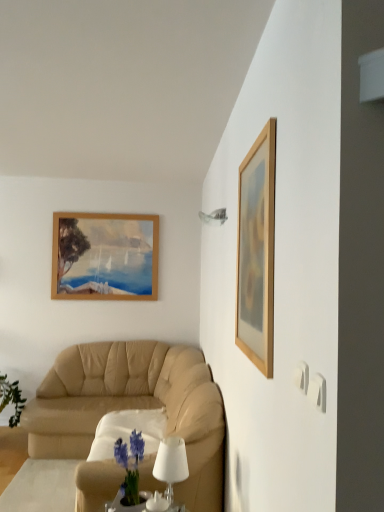
Question: Could you tell me if white matte table lamp at lower center is facing wooden picture frame at upper right?

Choices:
 (A) yes
 (B) no

Answer: (B)

Question: Is white matte table lamp at lower center to the left of wooden picture frame at upper right from the viewer's perspective?

Choices:
 (A) yes
 (B) no

Answer: (A)

Question: Is white matte table lamp at lower center taller than wooden picture frame at upper right?

Choices:
 (A) no
 (B) yes

Answer: (A)

Question: Is white matte table lamp at lower center behind wooden picture frame at upper right?

Choices:
 (A) no
 (B) yes

Answer: (B)

Question: Can you confirm if white matte table lamp at lower center is positioned to the right of wooden picture frame at upper right?

Choices:
 (A) no
 (B) yes

Answer: (A)

Question: From the image's perspective, is beige leather couch at lower left above or below wooden picture frame at upper right?

Choices:
 (A) below
 (B) above

Answer: (A)

Question: Is beige leather couch at lower left inside the boundaries of wooden picture frame at upper right, or outside?

Choices:
 (A) outside
 (B) inside

Answer: (A)

Question: Considering the positions of beige leather couch at lower left and wooden picture frame at upper right in the image, is beige leather couch at lower left wider or thinner than wooden picture frame at upper right?

Choices:
 (A) thin
 (B) wide

Answer: (B)

Question: Is beige leather couch at lower left in front of or behind wooden picture frame at upper right in the image?

Choices:
 (A) front
 (B) behind

Answer: (B)

Question: From a real-world perspective, is wooden picture frame at upper right positioned above or below white matte table lamp at lower center?

Choices:
 (A) below
 (B) above

Answer: (B)

Question: From the image's perspective, is wooden picture frame at upper right above or below white matte table lamp at lower center?

Choices:
 (A) above
 (B) below

Answer: (A)

Question: Does point (271, 218) appear closer or farther from the camera than point (178, 445)?

Choices:
 (A) closer
 (B) farther

Answer: (A)

Question: Considering their positions, is wooden picture frame at upper right located in front of or behind white matte table lamp at lower center?

Choices:
 (A) front
 (B) behind

Answer: (A)

Question: From the image's perspective, relative to wooden picture frame at upper right, is metallic glass lampshade at upper center above or below?

Choices:
 (A) above
 (B) below

Answer: (A)

Question: Is metallic glass lampshade at upper center wider or thinner than wooden picture frame at upper right?

Choices:
 (A) thin
 (B) wide

Answer: (B)